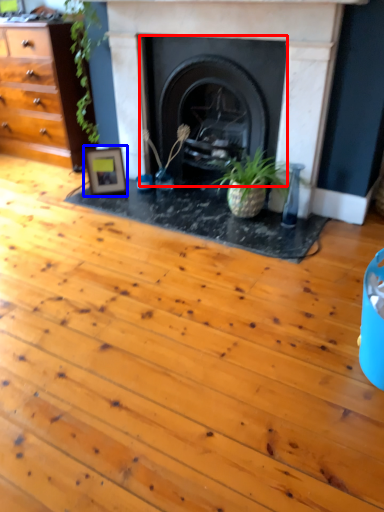
Question: Which of the following is the closest to the observer, fireplace (highlighted by a red box) or picture frame (highlighted by a blue box)?

Choices:
 (A) fireplace
 (B) picture frame

Answer: (A)